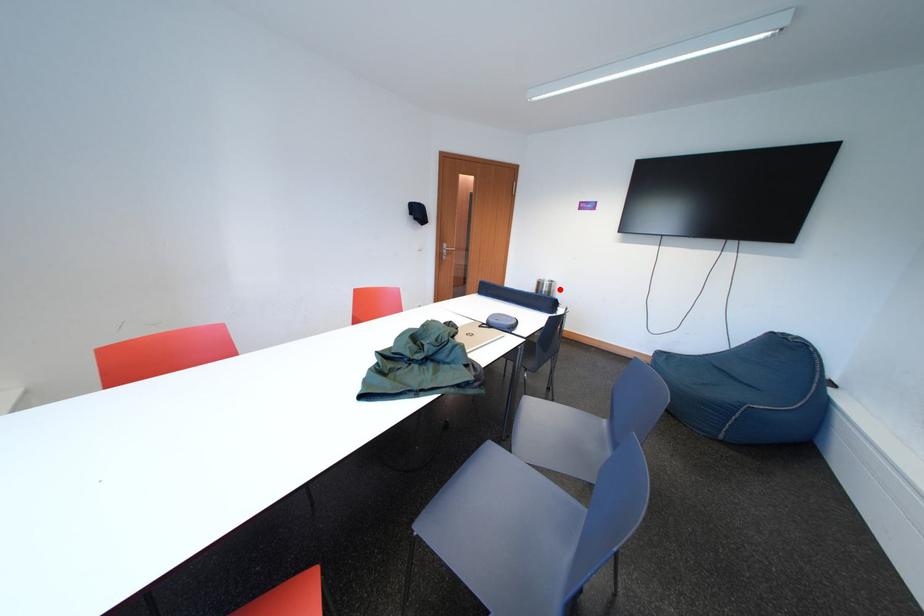
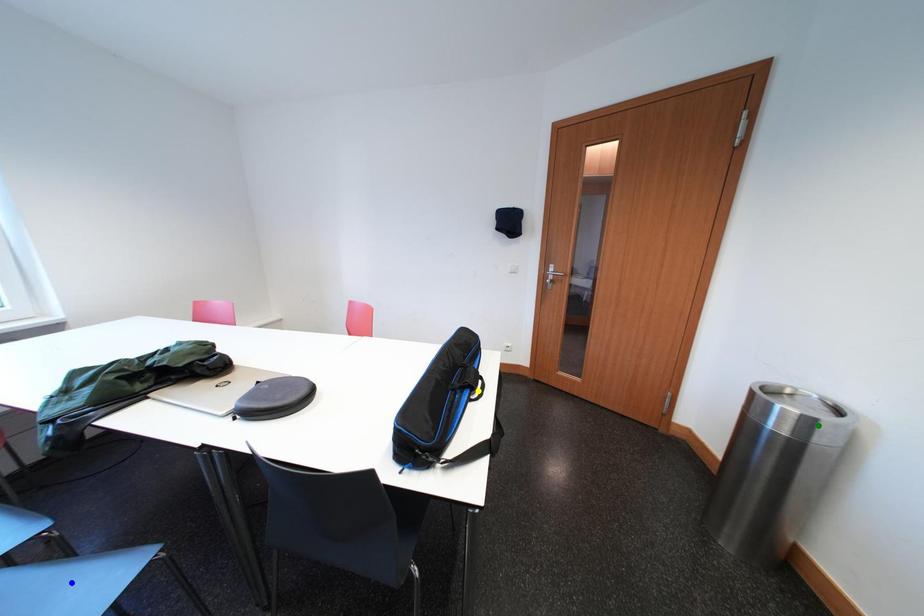
Question: I am providing you with two images of the same scene from different viewpoints. A red point is marked on the first image. You are given multiple points on the second image. Which point in image 2 represents the same 3d spot as the red point in image 1?

Choices:
 (A) green point
 (B) blue point
 (C) yellow point

Answer: (A)